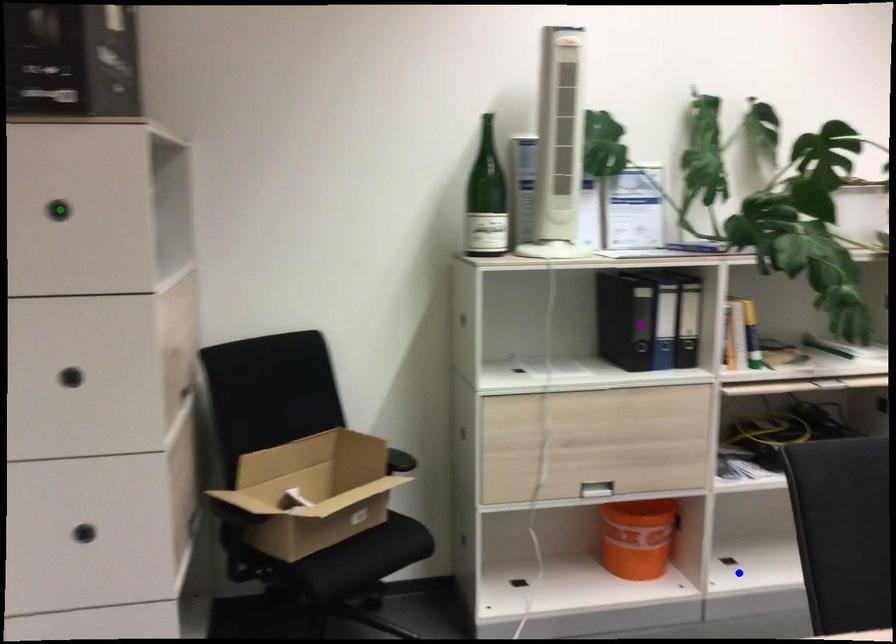
Order these from nearest to farthest:
green point, blue point, purple point

green point, purple point, blue point